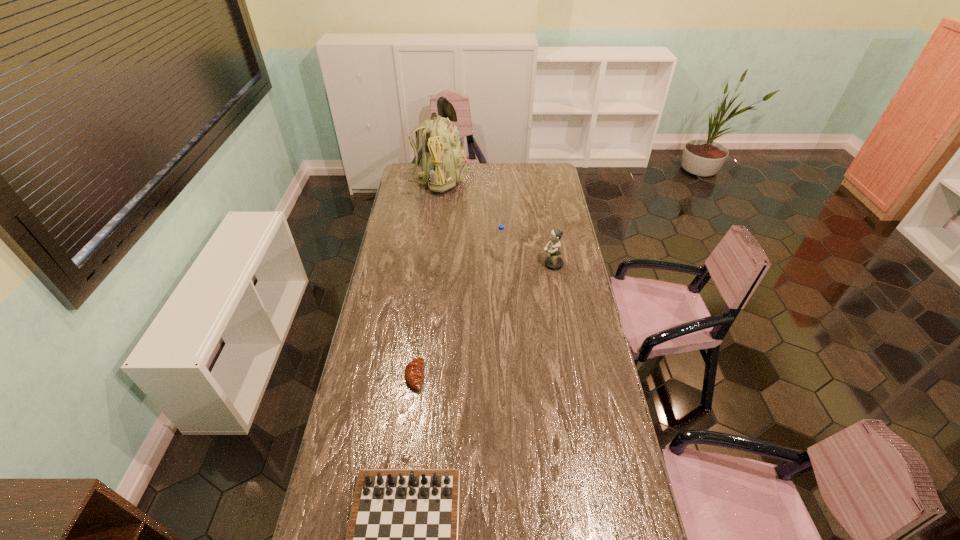
Where is `vacant space located on the right of the fourth object from left to right`? This screenshot has width=960, height=540. vacant space located on the right of the fourth object from left to right is located at coordinates (543, 258).

You are a GUI agent. You are given a task and a screenshot of the screen. Output one action in this format:
    pyautogui.click(x=<x>, y=<y>)
    Task: Click on the vacant space located 0.280m on the right of the crescent roll
    
    Given the screenshot: What is the action you would take?
    pyautogui.click(x=499, y=376)

The width and height of the screenshot is (960, 540). I want to click on object that is at the far edge, so click(443, 164).

The width and height of the screenshot is (960, 540). I want to click on object positioned at the left edge, so click(x=443, y=164).

Find the location of `object at the right edge`. object at the right edge is located at coordinates (553, 262).

The width and height of the screenshot is (960, 540). Identify the location of object at the far left corner. click(443, 164).

Image resolution: width=960 pixels, height=540 pixels. In the image, there is a desktop. Identify the location of vacant space at the far edge. (509, 163).

In the image, there is a desktop. Where is `free space at the left edge`? free space at the left edge is located at coordinates (410, 249).

In the image, there is a desktop. Where is `vacant space at the right edge`? Image resolution: width=960 pixels, height=540 pixels. vacant space at the right edge is located at coordinates (564, 219).

Image resolution: width=960 pixels, height=540 pixels. Find the location of `vacant space that's between the farthest object and the fourth object from left to right`. vacant space that's between the farthest object and the fourth object from left to right is located at coordinates (467, 219).